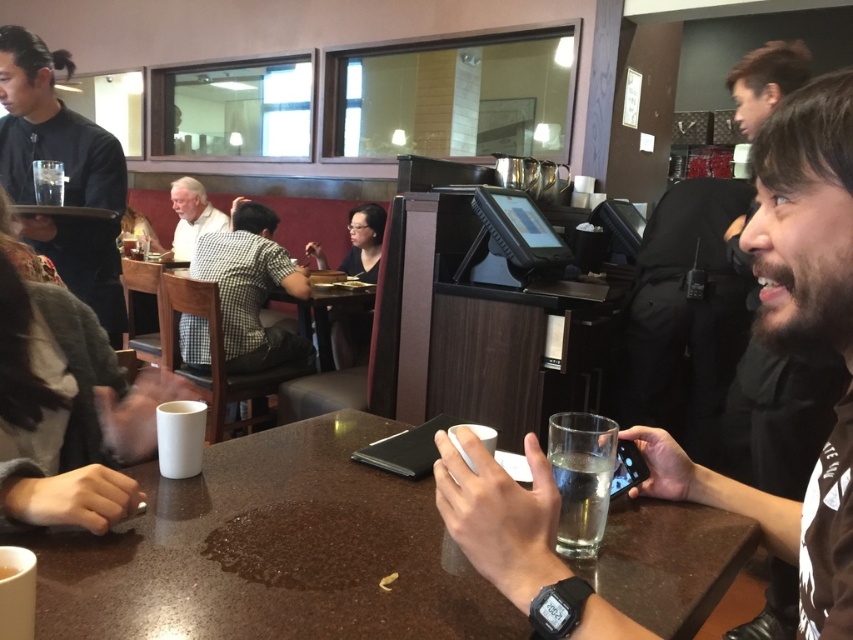
Can you confirm if marble table at center is thinner than black matte tray at upper left?

In fact, marble table at center might be wider than black matte tray at upper left.

Can you confirm if marble table at center is positioned above black matte tray at upper left?

No.

Is point (730, 561) positioned before point (45, 104)?

Yes.

The image size is (853, 640). Find the location of `marble table at center`. marble table at center is located at coordinates (271, 552).

The width and height of the screenshot is (853, 640). Describe the element at coordinates (51, 129) in the screenshot. I see `black matte tray at upper left` at that location.

Which is in front, point (32, 35) or point (563, 531)?

Point (563, 531) is more forward.

At what (x,y) coordinates should I click in order to perform the action: click on black matte tray at upper left. Please return your answer as a coordinate pair (x, y). The height and width of the screenshot is (640, 853). Looking at the image, I should click on (51, 129).

Can you confirm if marble table at center is wider than clear glass at center?

Yes.

Is marble table at center shorter than clear glass at center?

Incorrect, marble table at center's height does not fall short of clear glass at center's.

The width and height of the screenshot is (853, 640). I want to click on marble table at center, so click(x=271, y=552).